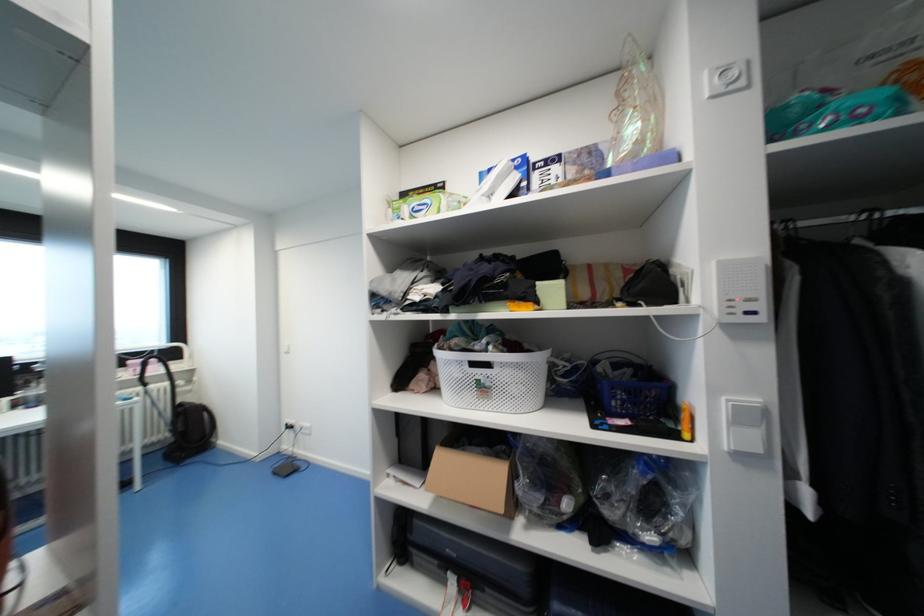
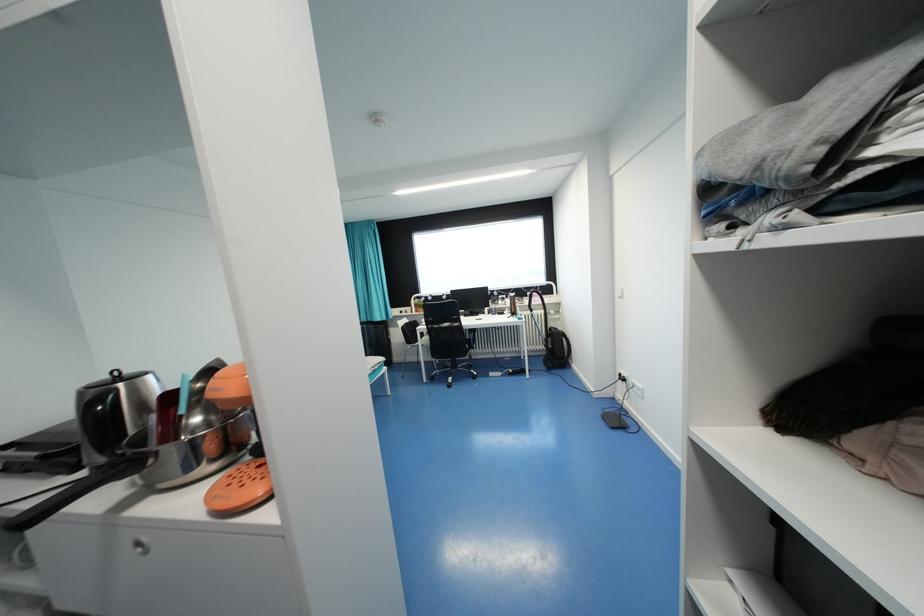
In the second image, find the point that corresponds to [178,424] in the first image.

(551, 342)